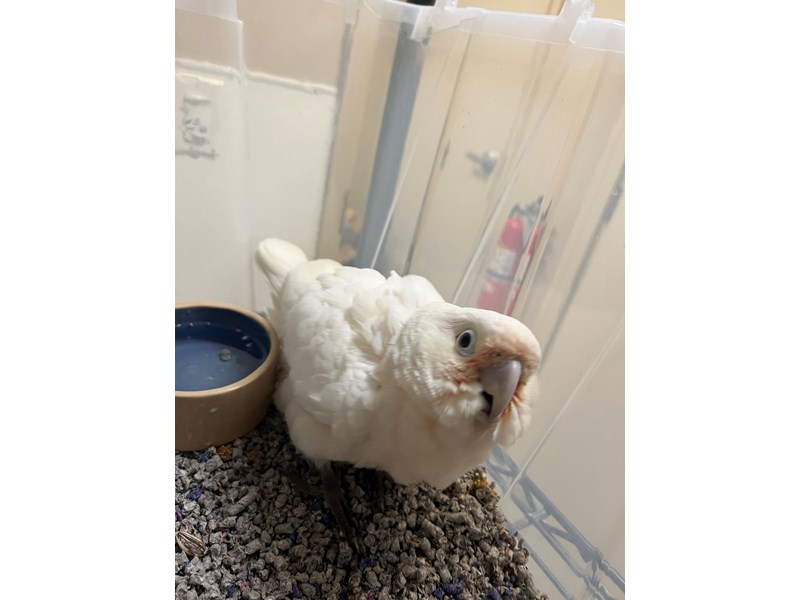
This screenshot has width=800, height=600. Identify the location of plastic container. (473, 197).